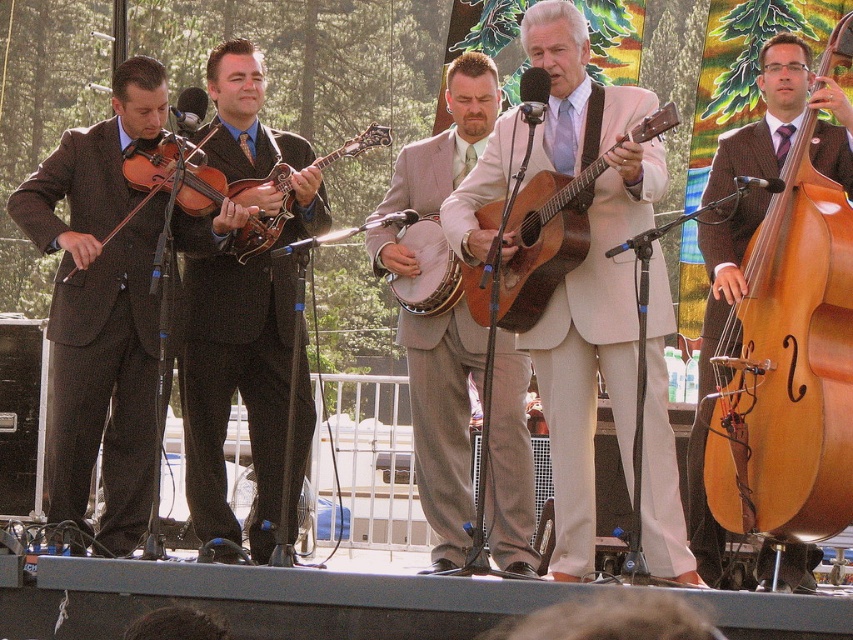
Who is higher up, light beige suit at center or shiny brown mandolin at center?

light beige suit at center

Is point (577, 76) positioned behind point (245, 92)?

No, it is in front of (245, 92).

I want to click on light beige suit at center, so click(595, 332).

Does point (788, 376) come closer to viewer compared to point (421, 253)?

Yes.

Between light brown polished wood cello at right and white fabric banjo at center, which one has less height?

white fabric banjo at center is shorter.

Describe the element at coordinates (788, 356) in the screenshot. The height and width of the screenshot is (640, 853). I see `light brown polished wood cello at right` at that location.

Find the location of a particular element. light brown polished wood cello at right is located at coordinates (788, 356).

You are a GUI agent. You are given a task and a screenshot of the screen. Output one action in this format:
    pyautogui.click(x=<x>, y=<y>)
    Task: Click on the brown matte acoustic guitar at center
    This screenshot has height=640, width=853.
    Given the screenshot: What is the action you would take?
    pyautogui.click(x=531, y=248)

Can you confirm if brown matte acoustic guitar at center is taller than matte brown mandolin at center?

No.

Identify the location of brown matte acoustic guitar at center. (531, 248).